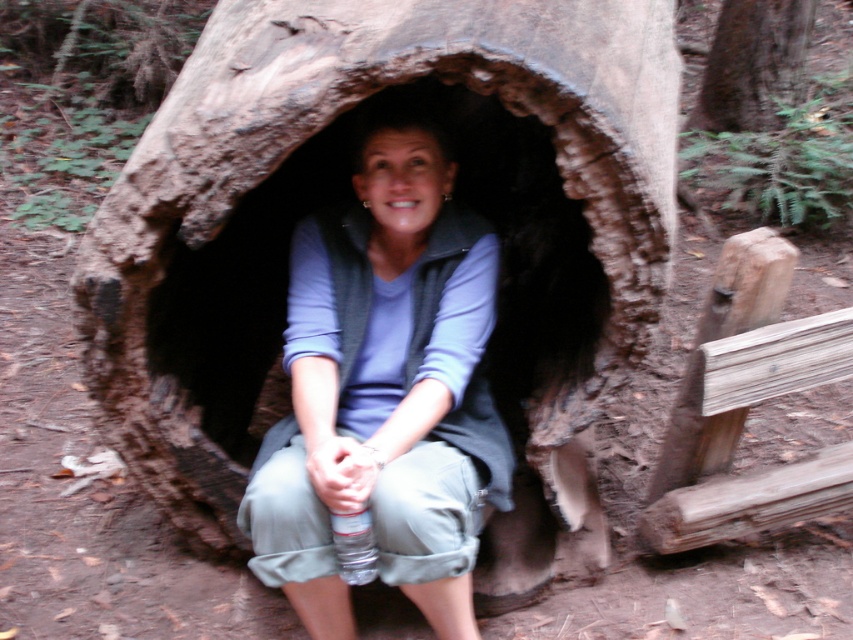
Which is more to the left, matte gray vest at center or brown rough bark at upper center?

From the viewer's perspective, matte gray vest at center appears more on the left side.

Does point (434, 493) come in front of point (699, 115)?

Yes.

This screenshot has width=853, height=640. Find the location of `matte gray vest at center`. matte gray vest at center is located at coordinates (386, 388).